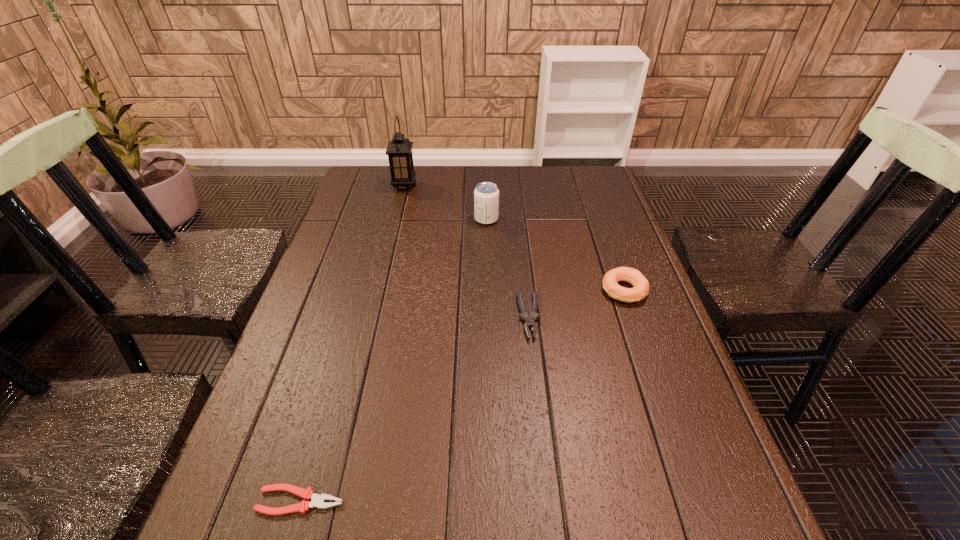
This screenshot has height=540, width=960. I want to click on vacant point that satisfies the following two spatial constraints: 1. on the front side of the lantern; 2. on the left side of the fourth nearest object, so click(x=396, y=219).